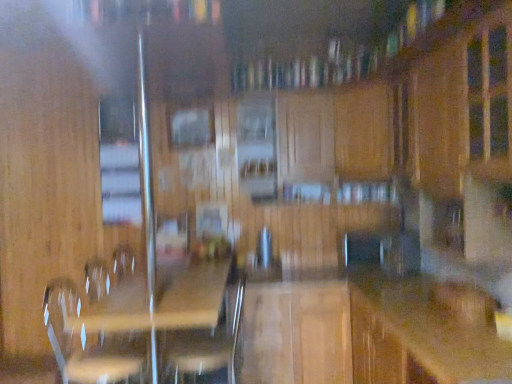
Question: Is wooden counter top at center completely or partially outside of clear wood picnic table at center?

Choices:
 (A) yes
 (B) no

Answer: (A)

Question: Considering the relative sizes of wooden counter top at center and clear wood picnic table at center in the image provided, is wooden counter top at center shorter than clear wood picnic table at center?

Choices:
 (A) yes
 (B) no

Answer: (A)

Question: Could clear wood picnic table at center be considered to be inside wooden counter top at center?

Choices:
 (A) no
 (B) yes

Answer: (A)

Question: Does wooden counter top at center have a greater width compared to clear wood picnic table at center?

Choices:
 (A) yes
 (B) no

Answer: (B)

Question: Is wooden counter top at center smaller than clear wood picnic table at center?

Choices:
 (A) no
 (B) yes

Answer: (B)

Question: Is wooden counter top at center positioned behind clear wood picnic table at center?

Choices:
 (A) yes
 (B) no

Answer: (B)

Question: Could you tell me if clear wood picnic table at center is turned towards wooden swivel chair at center, the 1th swivel chair when ordered from right to left?

Choices:
 (A) no
 (B) yes

Answer: (B)

Question: Is clear wood picnic table at center located outside wooden swivel chair at center, the 1th swivel chair when ordered from right to left?

Choices:
 (A) yes
 (B) no

Answer: (A)

Question: Is clear wood picnic table at center to the right of wooden swivel chair at center, arranged as the second swivel chair when viewed from the left, from the viewer's perspective?

Choices:
 (A) no
 (B) yes

Answer: (A)

Question: From the image's perspective, is clear wood picnic table at center over wooden swivel chair at center, arranged as the second swivel chair when viewed from the left?

Choices:
 (A) no
 (B) yes

Answer: (A)

Question: Considering the relative positions of clear wood picnic table at center and wooden swivel chair at center, arranged as the second swivel chair when viewed from the left, in the image provided, is clear wood picnic table at center in front of wooden swivel chair at center, arranged as the second swivel chair when viewed from the left,?

Choices:
 (A) yes
 (B) no

Answer: (A)

Question: Considering the relative sizes of clear wood picnic table at center and wooden swivel chair at center, arranged as the second swivel chair when viewed from the left, in the image provided, is clear wood picnic table at center wider than wooden swivel chair at center, arranged as the second swivel chair when viewed from the left,?

Choices:
 (A) yes
 (B) no

Answer: (A)

Question: Does wooden swivel chair at center, the 1th swivel chair when ordered from right to left, come behind clear plastic swivel chair at lower left, the 2th swivel chair viewed from the right?

Choices:
 (A) yes
 (B) no

Answer: (A)